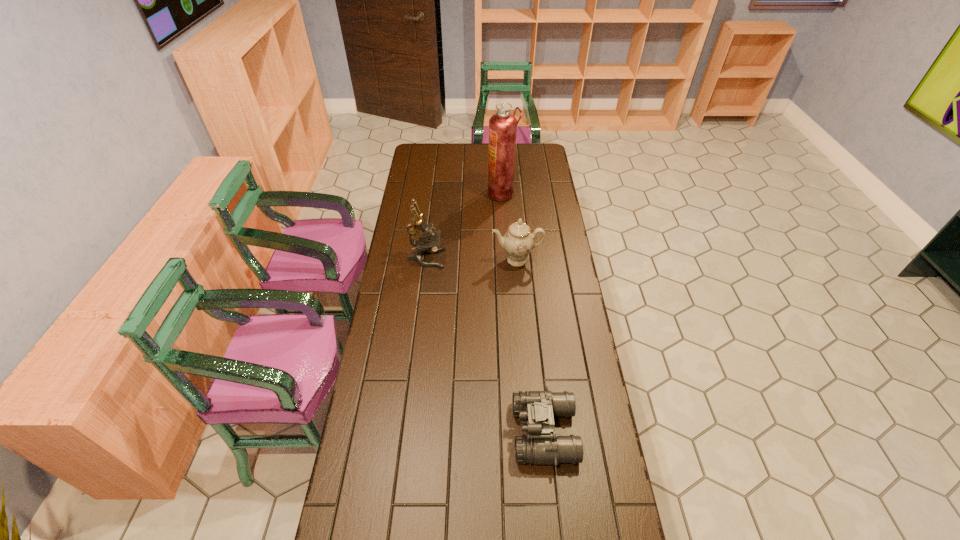
Image resolution: width=960 pixels, height=540 pixels. Find the location of `the farthest object`. the farthest object is located at coordinates (502, 126).

This screenshot has height=540, width=960. Identify the location of the tallest object. (502, 126).

The height and width of the screenshot is (540, 960). Find the location of `the second tallest object`. the second tallest object is located at coordinates (427, 242).

This screenshot has height=540, width=960. What are the coordinates of `microscope` in the screenshot? It's located at (427, 242).

In order to click on chinaware in this screenshot , I will do `click(518, 241)`.

Where is `the shortest object`? the shortest object is located at coordinates (536, 410).

What are the coordinates of `the nearest object` in the screenshot? It's located at (536, 410).

At what (x,y) coordinates should I click in order to perform the action: click on free space located on the side of the tallest object with the label. Please return your answer as a coordinate pair (x, y). Looking at the image, I should click on (410, 193).

Where is `vacant space located on the side of the tallest object with the label`? Image resolution: width=960 pixels, height=540 pixels. vacant space located on the side of the tallest object with the label is located at coordinates (416, 193).

Find the location of a particular element. free space located 0.180m on the side of the tallest object with the label is located at coordinates (451, 193).